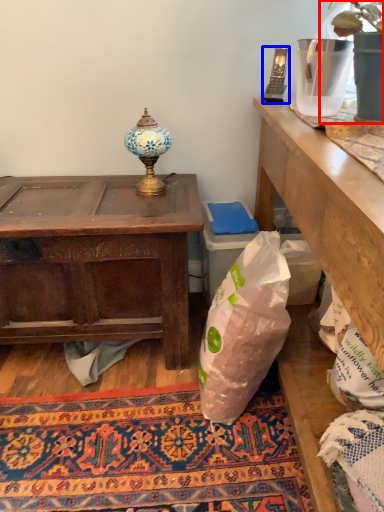
Question: Which of the following is the closest to the observer, houseplant (highlighted by a red box) or mobile phone (highlighted by a blue box)?

Choices:
 (A) houseplant
 (B) mobile phone

Answer: (A)